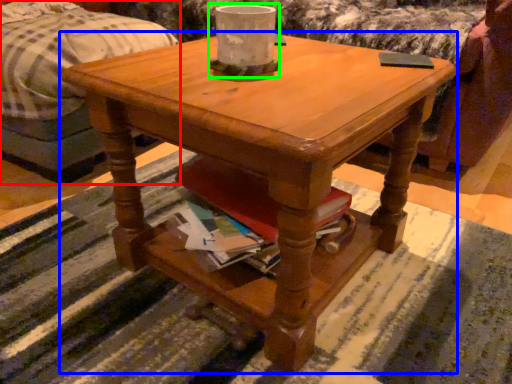
Question: Which is nearer to the bed (highlighted by a red box)? coffee table (highlighted by a blue box) or candle holder (highlighted by a green box).

Choices:
 (A) coffee table
 (B) candle holder

Answer: (A)